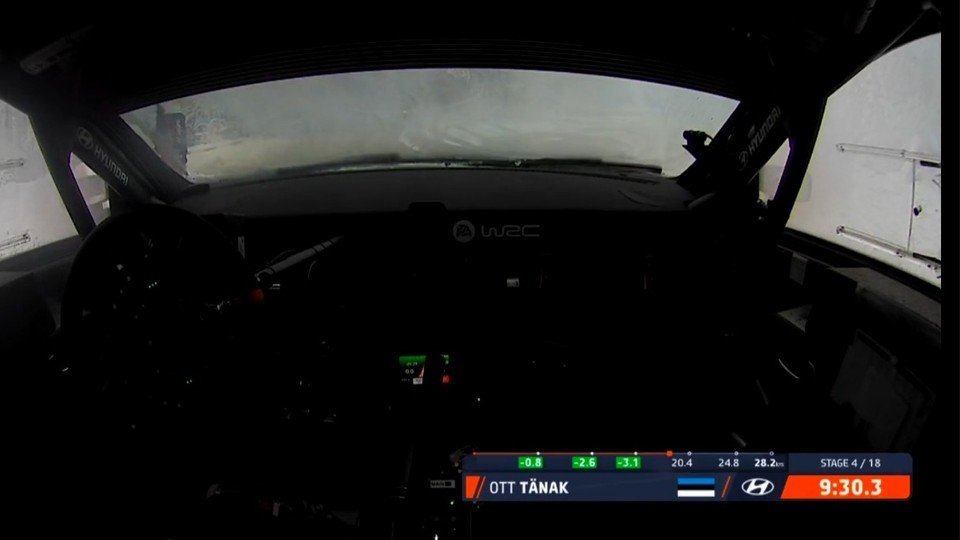
Where is `door handle`? This screenshot has height=540, width=960. door handle is located at coordinates click(783, 364).